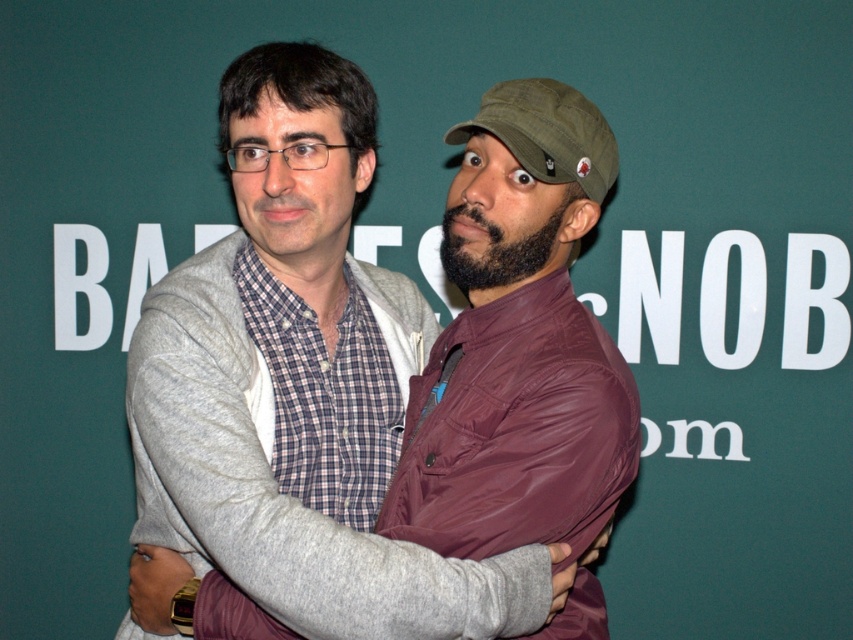
Does matte gray hoodie at center appear under green fabric baseball cap at upper right?

Yes, matte gray hoodie at center is below green fabric baseball cap at upper right.

Which is more to the right, matte gray hoodie at center or green fabric baseball cap at upper right?

Positioned to the right is green fabric baseball cap at upper right.

Identify the location of matte gray hoodie at center. The height and width of the screenshot is (640, 853). (518, 342).